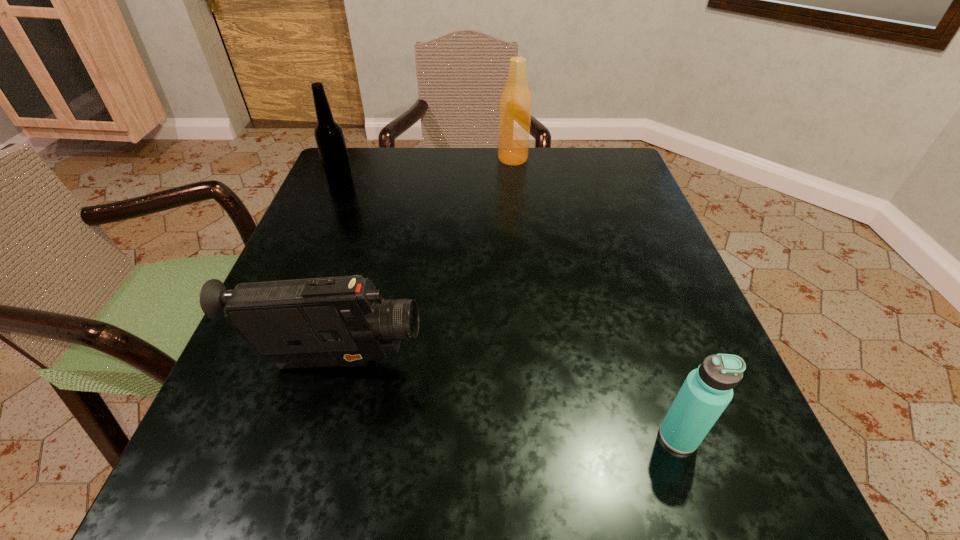
The image size is (960, 540). I want to click on unoccupied area between the camcorder and the farthest object, so click(423, 261).

Locate an element on the screen. This screenshot has height=540, width=960. vacant region between the nearest object and the second nearest object is located at coordinates (507, 400).

Find the location of a particular element. The width and height of the screenshot is (960, 540). vacant point located between the left beer bottle and the nearest object is located at coordinates (510, 310).

This screenshot has width=960, height=540. Identify the location of vacant space that is in between the nearer beer bottle and the nearest object. (510, 310).

Locate which object ranks in proximity to the thermos bottle. Please provide its 2D coordinates. Your answer should be formatted as a tuple, i.e. [(x, y)], where the tuple contains the x and y coordinates of a point satisfying the conditions above.

[(331, 321)]

Locate an element on the screen. This screenshot has width=960, height=540. object that is the third closest to the third nearest object is located at coordinates (706, 392).

Locate an element on the screen. This screenshot has height=540, width=960. free location that satisfies the following two spatial constraints: 1. on the front-facing side of the thermos bottle; 2. on the left side of the second nearest object is located at coordinates (314, 436).

At what (x,y) coordinates should I click in order to perform the action: click on vacant point that satisfies the following two spatial constraints: 1. on the front side of the nearest object; 2. on the right side of the farthest object. Please return your answer as a coordinate pair (x, y). This screenshot has width=960, height=540. Looking at the image, I should click on (542, 436).

You are a GUI agent. You are given a task and a screenshot of the screen. Output one action in this format:
    pyautogui.click(x=<x>, y=<y>)
    Task: Click on the free location that satisfies the following two spatial constraints: 1. on the front-facing side of the rightmost object; 2. on the right side of the camcorder
    Image resolution: width=960 pixels, height=540 pixels.
    Given the screenshot: What is the action you would take?
    pyautogui.click(x=314, y=436)

Image resolution: width=960 pixels, height=540 pixels. Identify the location of vacant space that satisfies the following two spatial constraints: 1. on the front-facing side of the third farthest object; 2. on the left side of the nearest object. (314, 436).